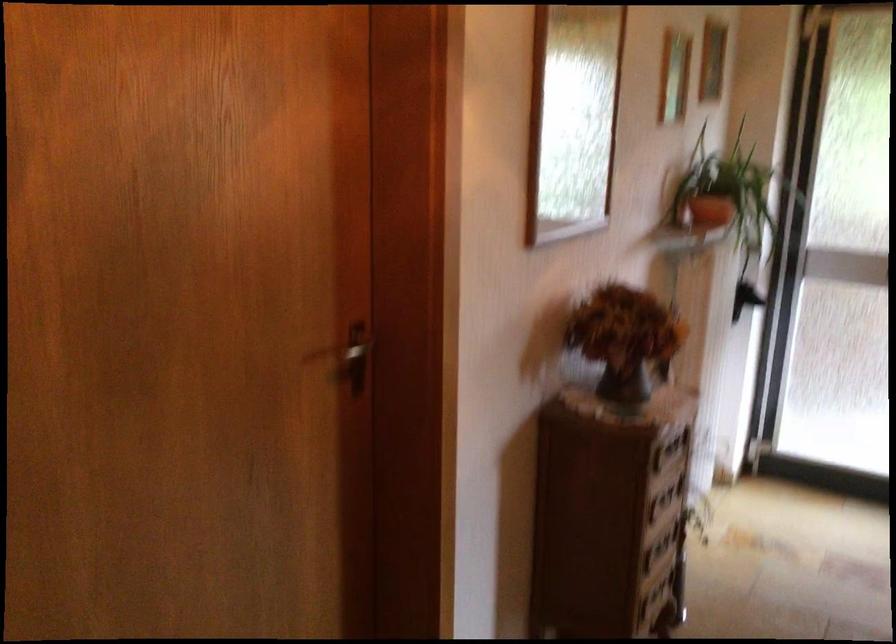
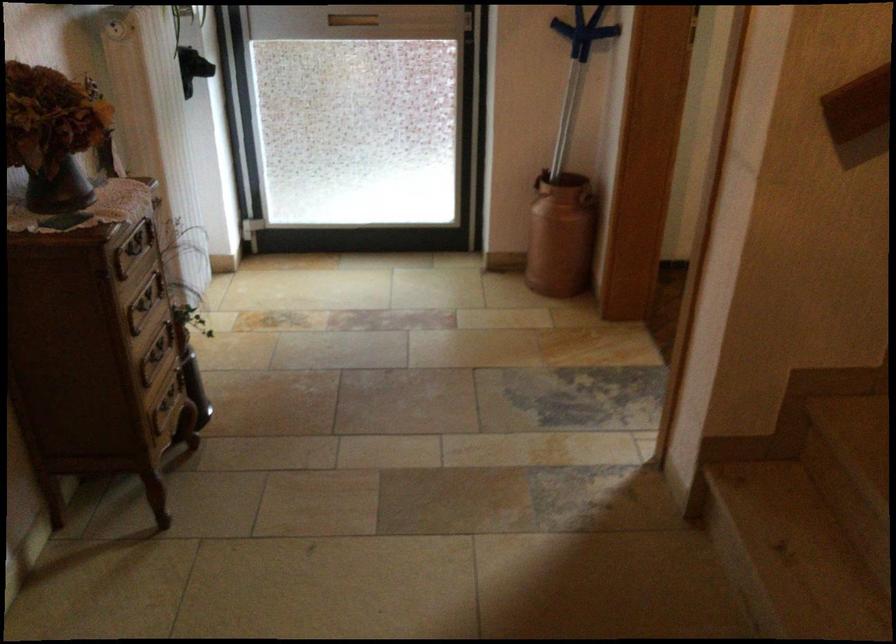
Where in the second image is the point corresponding to point (660, 549) from the first image?

(156, 355)